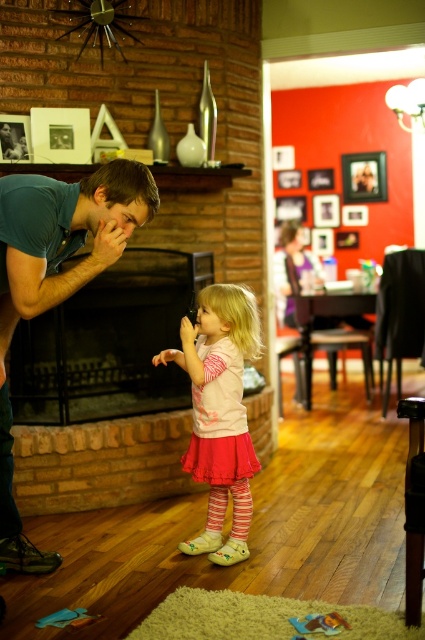
You are a tailor who needs to determine which item requires more fabric for a repair. Based on the scene, which object between the teal cotton shirt at left and the wooden picture frame at upper center would need more fabric?

The teal cotton shirt at left requires more fabric for repair since it is bigger than the wooden picture frame at upper center.

You are a guest entering the living room and see the teal cotton shirt at left and the metallic silver picture frame at upper left. Which object is positioned lower in the room?

The teal cotton shirt at left is located below the metallic silver picture frame at upper left, so it is positioned lower in the room.